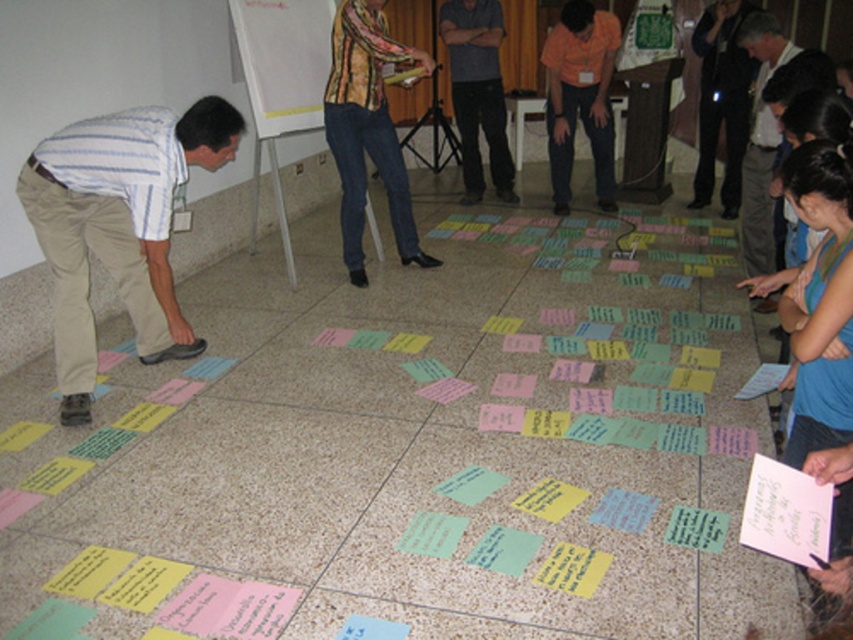
Question: Estimate the real-world distances between objects in this image. Which object is farther from the khaki cotton pants at lower left?

Choices:
 (A) orange shirt at center
 (B) dark gray shirt at center
 (C) striped cotton shirt at center

Answer: (B)

Question: Which point is closer to the camera?

Choices:
 (A) khaki cotton pants at lower left
 (B) orange shirt at center
 (C) wooden whiteboard at upper center
 (D) striped cotton shirt at center

Answer: (A)

Question: Is wooden whiteboard at upper center to the left of orange shirt at center from the viewer's perspective?

Choices:
 (A) yes
 (B) no

Answer: (A)

Question: Can you confirm if khaki cotton pants at lower left is thinner than dark gray shirt at center?

Choices:
 (A) no
 (B) yes

Answer: (A)

Question: Where is orange shirt at center located in relation to dark gray shirt at center in the image?

Choices:
 (A) right
 (B) left

Answer: (A)

Question: Considering the real-world distances, which object is closest to the wooden whiteboard at upper center?

Choices:
 (A) khaki cotton pants at lower left
 (B) dark gray shirt at center
 (C) striped cotton shirt at center
 (D) orange shirt at center

Answer: (C)